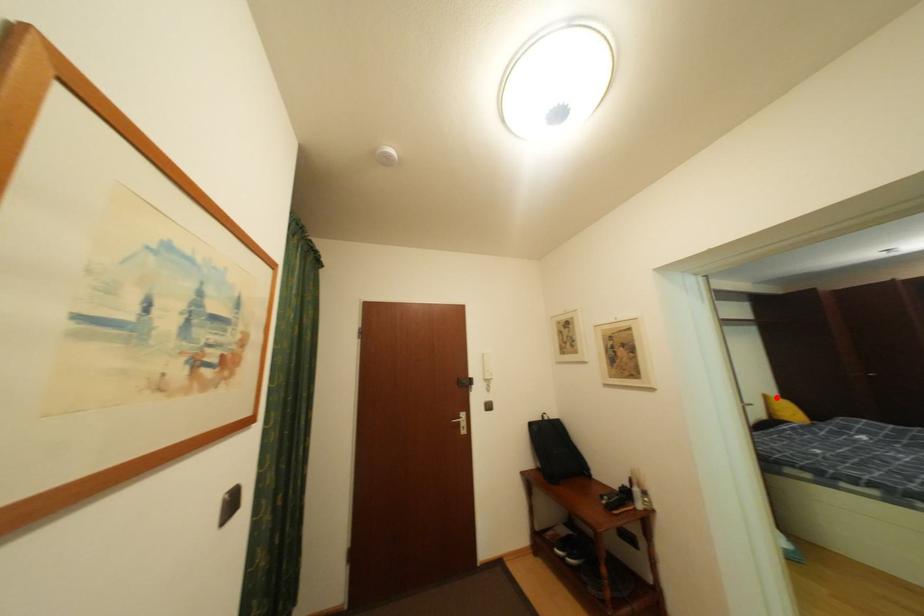
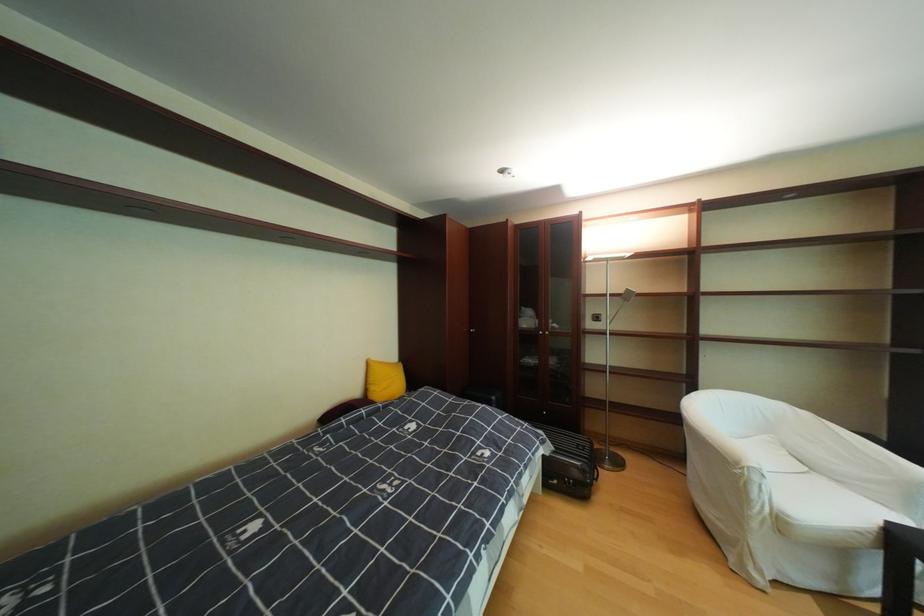
Where in the second image is the point corresponding to the highlighted location from the first image?

(380, 363)